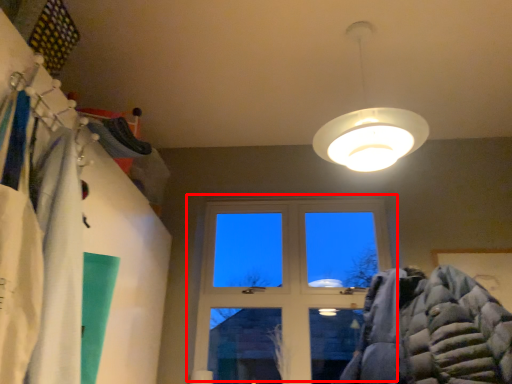
Question: From the image's perspective, where is window (annotated by the red box) located relative to lamp?

Choices:
 (A) below
 (B) above

Answer: (A)